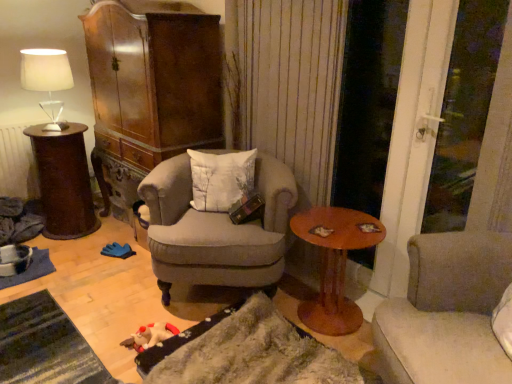
Question: In terms of height, does fuzzy fabric blanket at lower center look taller or shorter compared to dark brown wooden side table at left, positioned as the 1th table in back-to-front order?

Choices:
 (A) short
 (B) tall

Answer: (A)

Question: Does point (338, 380) appear closer or farther from the camera than point (57, 208)?

Choices:
 (A) closer
 (B) farther

Answer: (A)

Question: Considering the real-world distances, which object is farthest from the dark brown wooden side table at left, arranged as the second table when viewed from the front?

Choices:
 (A) beige fabric studio couch at right
 (B) white fabric lampshade at upper left
 (C) transparent glass screen door at right
 (D) light gray fabric armchair at center
 (E) fuzzy fabric blanket at lower center

Answer: (A)

Question: Based on their relative distances, which object is nearer to the beige fabric studio couch at right?

Choices:
 (A) wooden round table at center, acting as the 2th table starting from the back
 (B) white textured pillow at center
 (C) white fabric lampshade at upper left
 (D) light gray fabric armchair at center
 (E) fuzzy fabric blanket at lower center

Answer: (E)